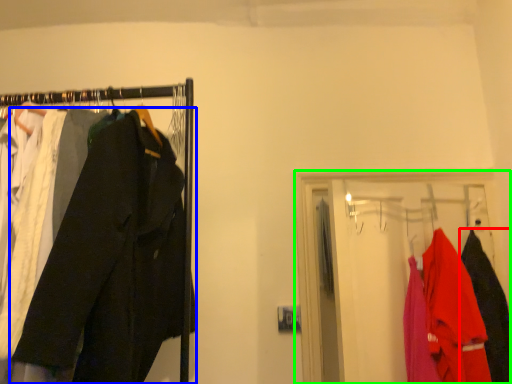
Question: Which object is the closest to the clothing (highlighted by a red box)? Choose among these: trousers (highlighted by a blue box) or closet (highlighted by a green box).

Choices:
 (A) trousers
 (B) closet

Answer: (B)